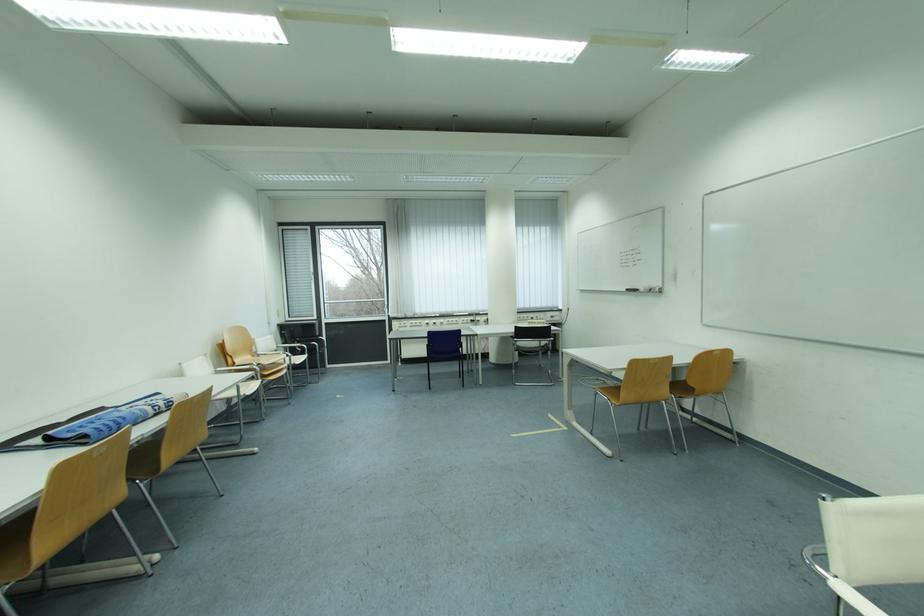
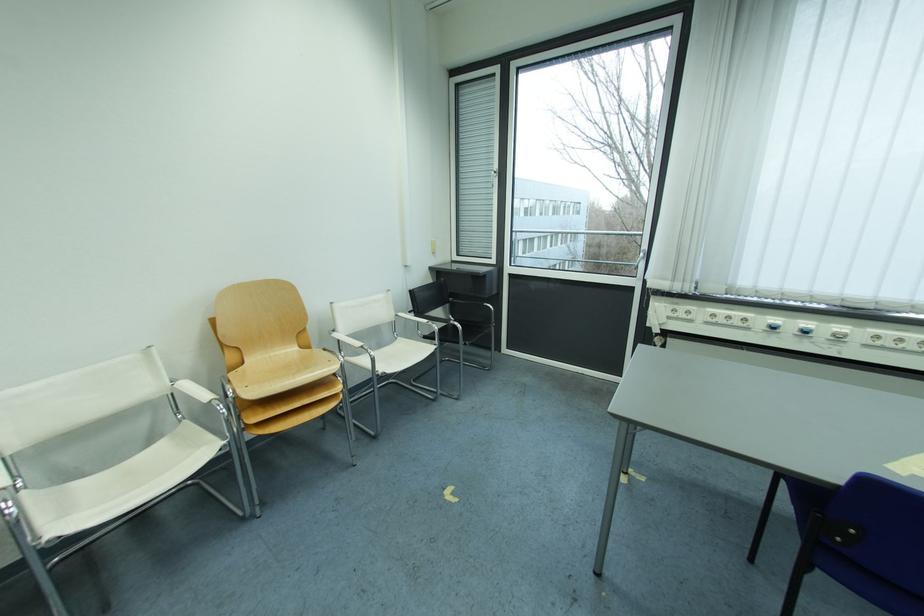
In the second image, find the point that corresponds to [444,323] in the first image.

(816, 326)